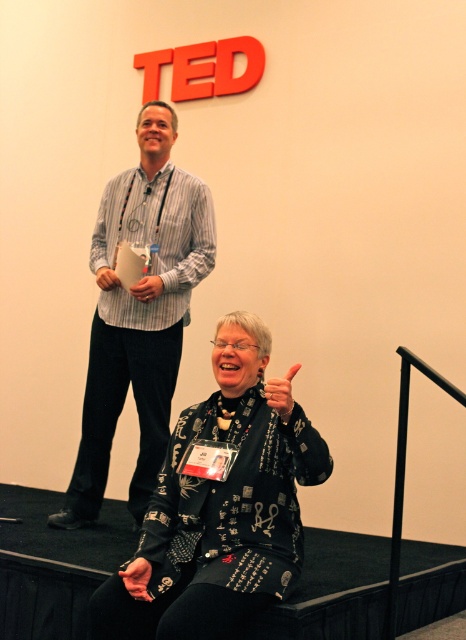
You are an event organizer preparing for a TED talk. You need to ensure that the printed fabric sweater at lower center and the striped cotton shirt at upper left can both fit on a display rack that is 1.2 meters wide. Based on their widths, will they fit together?

The printed fabric sweater at lower center has a lesser width compared to striped cotton shirt at upper left. However, without knowing the exact widths of both items, we cannot determine if their combined width exceeds 1.2 meters. Additional measurements are needed to confirm.

You are an event organizer planning to display two items from the stage in a promotional booth. The printed fabric sweater at lower center and the striped cotton shirt at upper left. Which item should you choose if you want to display an item that takes up more space?

The striped cotton shirt at upper left should be chosen because it occupies more space than the printed fabric sweater at lower center.